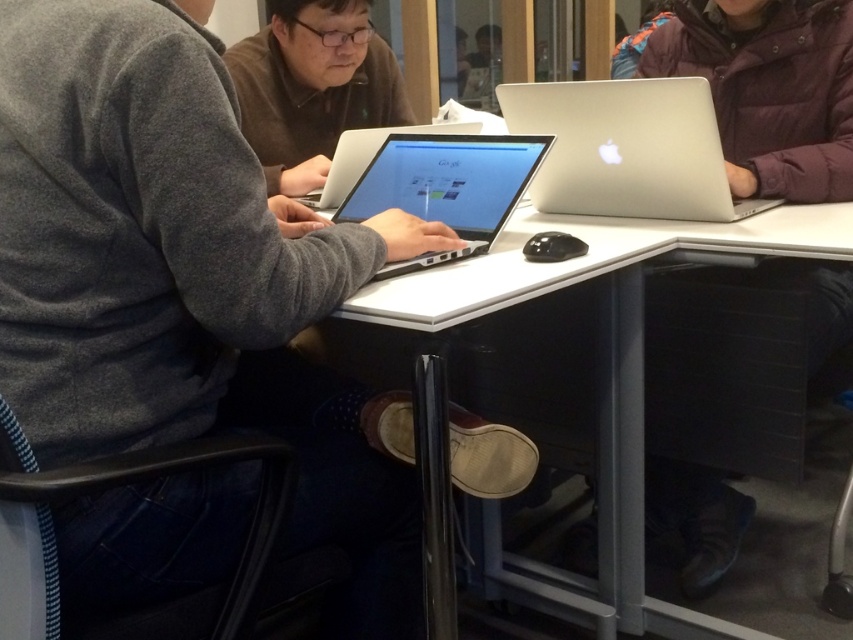
You are a delivery person who needs to place a rectangular box that is 12 cm tall on the desk. The box must be placed between the silver metallic laptop at upper right and the sleek silver laptop at center. Can the box fit vertically between them based on their heights?

The silver metallic laptop at upper right is taller than the sleek silver laptop at center. Since the box is 12 cm tall, it can only fit vertically if there is enough vertical space between the two laptops. However, the height difference between the laptops isn

You are standing in front of a desk with a silver metallic laptop at upper right. If you want to reach the laptop without moving your feet, can you do it?

The silver metallic laptop at upper right is 1.22 meters away from you, which is beyond typical arm reach. You cannot reach it without moving your feet.